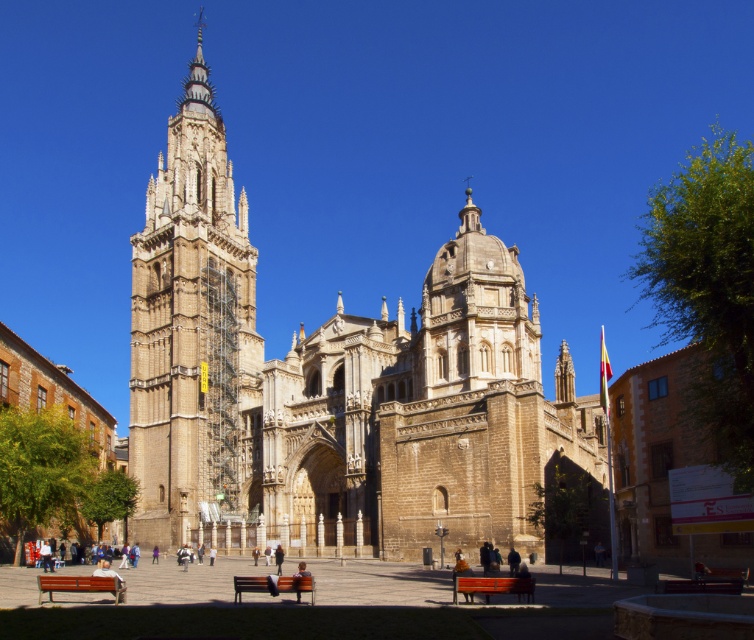
You are a tourist visiting Toledo Cathedral and need to sit down. You see two wooden benches in the foreground. Which bench would be higher from the ground, the wooden bench at lower left or the wooden bench at lower center?

The wooden bench at lower left is much taller than the wooden bench at lower center, so the wooden bench at lower left is higher from the ground.